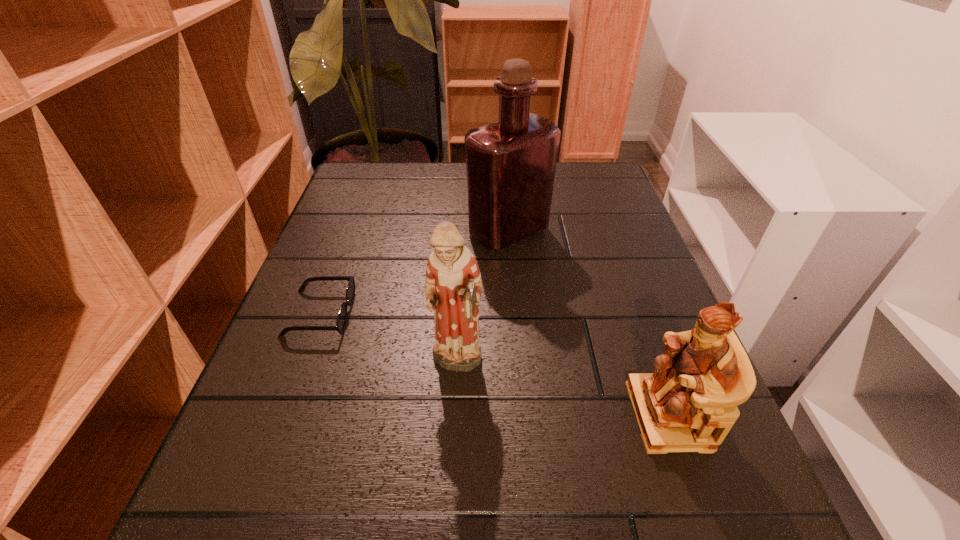
Where is `vacant space located on the front-facing side of the third tallest object`? vacant space located on the front-facing side of the third tallest object is located at coordinates (433, 416).

At what (x,y) coordinates should I click in order to perform the action: click on free point located 0.370m on the front-facing side of the third tallest object. Please return your answer as a coordinate pair (x, y). The width and height of the screenshot is (960, 540). Looking at the image, I should click on (387, 416).

The width and height of the screenshot is (960, 540). In order to click on vacant space located on the front-facing side of the third tallest object in this screenshot , I will do `click(554, 416)`.

Where is `free region located on the front-facing side of the second farthest object`? free region located on the front-facing side of the second farthest object is located at coordinates (400, 313).

Where is `object that is positioned at the left edge`? The image size is (960, 540). object that is positioned at the left edge is located at coordinates click(341, 320).

What are the coordinates of `object present at the right edge` in the screenshot? It's located at (689, 403).

In the image, there is a desktop. Where is `vacant space at the far edge`? The width and height of the screenshot is (960, 540). vacant space at the far edge is located at coordinates tap(555, 193).

Identify the location of free point at the left edge. The height and width of the screenshot is (540, 960). (319, 341).

Identify the location of vacant space at the right edge of the desktop. This screenshot has width=960, height=540. (652, 323).

Where is `vacant area at the far left corner of the desktop`? vacant area at the far left corner of the desktop is located at coordinates (357, 193).